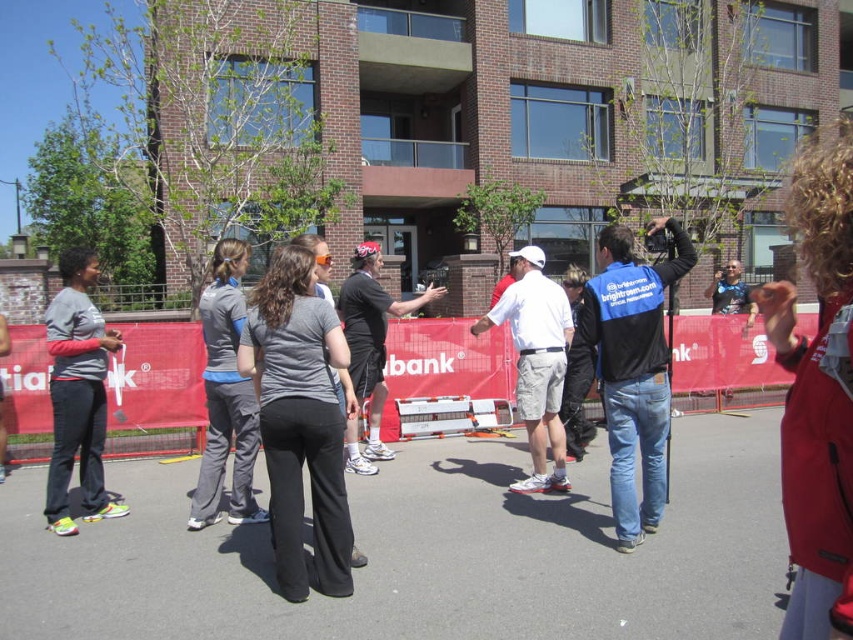
Question: In this image, where is matte gray shirt at left located relative to gray fabric pants at center?

Choices:
 (A) below
 (B) above

Answer: (A)

Question: Does red fabric barrier at center appear on the left side of gray fabric pants at center?

Choices:
 (A) yes
 (B) no

Answer: (B)

Question: Which point is farther from the camera taking this photo?

Choices:
 (A) (637, 424)
 (B) (236, 356)

Answer: (A)

Question: Which object appears farthest from the camera in this image?

Choices:
 (A) gray matte pants at center
 (B) black cotton t-shirt at center

Answer: (B)

Question: Is red fabric barrier at center behind black cotton t-shirt at center?

Choices:
 (A) no
 (B) yes

Answer: (B)

Question: Among these objects, which one is farthest from the camera?

Choices:
 (A) black cotton t-shirt at center
 (B) gray fabric pants at center
 (C) red fabric barrier at center

Answer: (C)